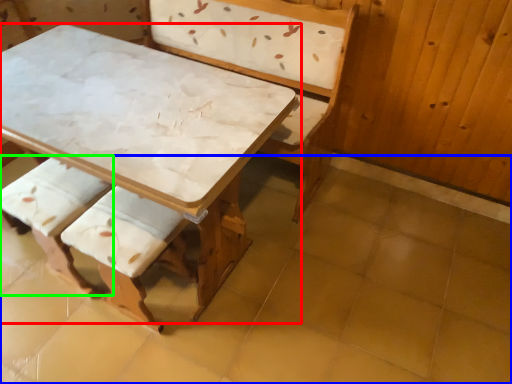
Question: Considering the real-world distances, which object is farthest from table (highlighted by a red box)? tile (highlighted by a blue box) or armchair (highlighted by a green box)?

Choices:
 (A) tile
 (B) armchair

Answer: (A)